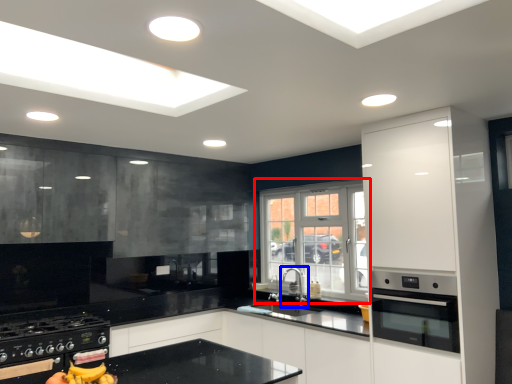
Question: Which object is further to the camera taking this photo, window (highlighted by a red box) or tap (highlighted by a blue box)?

Choices:
 (A) window
 (B) tap

Answer: (B)